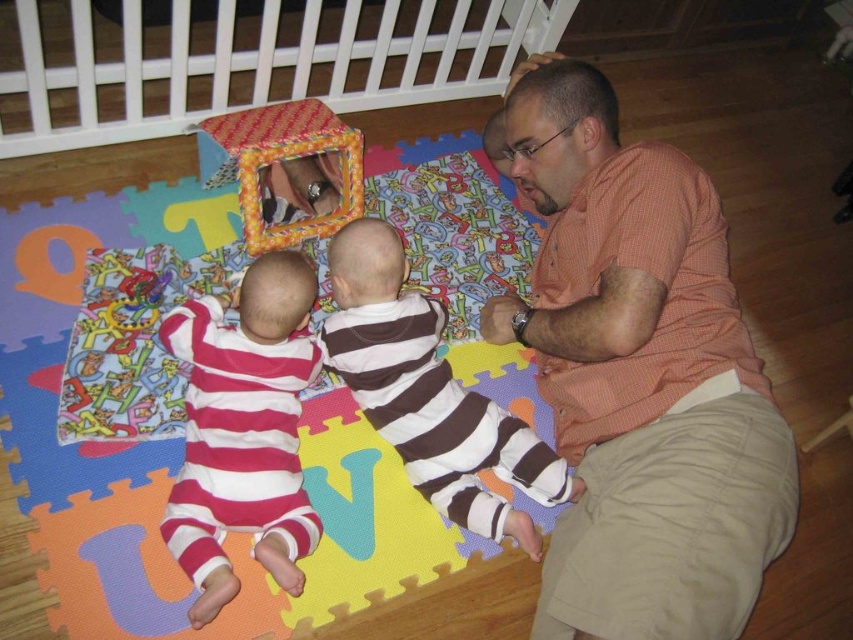
Which is above, pink striped onesie at lower left or brown striped shirt at center?

Positioned higher is brown striped shirt at center.

Can you confirm if pink striped onesie at lower left is shorter than brown striped shirt at center?

Yes.

This screenshot has width=853, height=640. I want to click on pink striped onesie at lower left, so click(242, 429).

Is textured fabric playpen at upper center thinner than plaid fabric cube at upper center?

In fact, textured fabric playpen at upper center might be wider than plaid fabric cube at upper center.

Is textured fabric playpen at upper center shorter than plaid fabric cube at upper center?

No, textured fabric playpen at upper center is not shorter than plaid fabric cube at upper center.

Is point (196, 61) behind point (323, 131)?

Yes.

The width and height of the screenshot is (853, 640). What are the coordinates of `textured fabric playpen at upper center` in the screenshot? It's located at (260, 65).

Is orange checkered shirt at upper right below plaid fabric cube at upper center?

Yes.

Does point (607, 156) lie behind point (305, 148)?

No.

Between point (613, 140) and point (274, 230), which one is positioned behind?

Positioned behind is point (274, 230).

The width and height of the screenshot is (853, 640). In order to click on orange checkered shirt at upper right in this screenshot , I will do `click(640, 376)`.